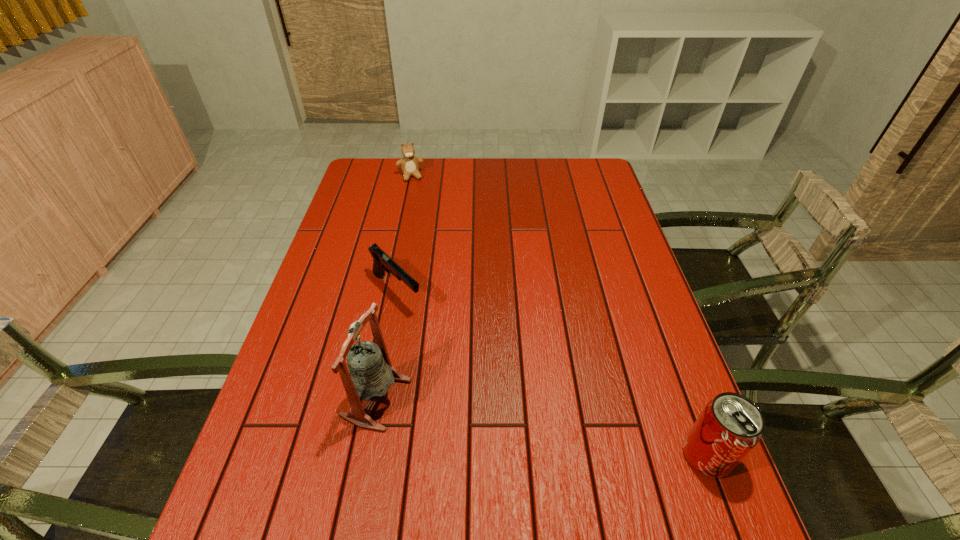
Locate an element on the screen. vacant space positioned 0.210m at the aiming end of the gun is located at coordinates (464, 360).

You are a GUI agent. You are given a task and a screenshot of the screen. Output one action in this format:
    pyautogui.click(x=<x>, y=<y>)
    Task: Click on the vacant area situated 0.270m at the aiming end of the gun
    Image resolution: width=960 pixels, height=540 pixels.
    Given the screenshot: What is the action you would take?
    pyautogui.click(x=480, y=376)

You are a GUI agent. You are given a task and a screenshot of the screen. Output one action in this format:
    pyautogui.click(x=<x>, y=<y>)
    Task: Click on the free space located at the aiming end of the gun
    Image resolution: width=960 pixels, height=540 pixels.
    Given the screenshot: What is the action you would take?
    pyautogui.click(x=458, y=355)

Find the location of a particular element. The height and width of the screenshot is (540, 960). object at the far edge is located at coordinates (409, 163).

Locate an element on the screen. object at the near edge is located at coordinates (729, 427).

Locate an element on the screen. bell that is at the left edge is located at coordinates (370, 374).

The width and height of the screenshot is (960, 540). What are the coordinates of `teddy bear at the left edge` in the screenshot? It's located at (409, 163).

Find the location of a particular element. The image size is (960, 540). gun that is at the left edge is located at coordinates (382, 262).

Locate an element on the screen. The height and width of the screenshot is (540, 960). object at the right edge is located at coordinates (729, 427).

Where is `object that is at the far left corner`? This screenshot has width=960, height=540. object that is at the far left corner is located at coordinates (409, 163).